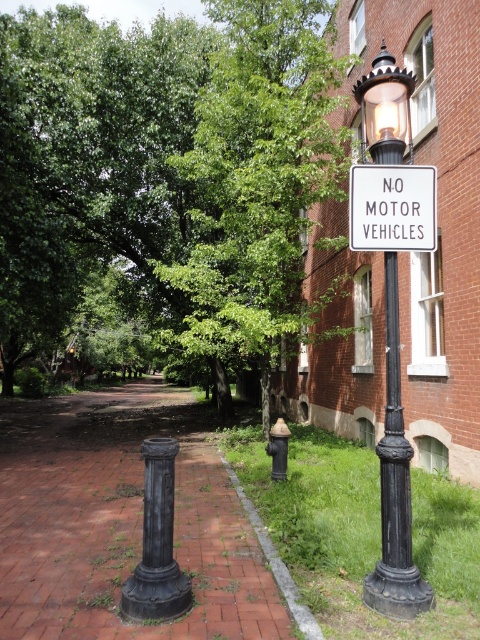
You are a city planner assessing the street layout. You need to install a new streetlight that must be taller than the existing black cast iron post at center. Can the black wrought iron lamp post at center right serve as a suitable replacement?

The black wrought iron lamp post at center right has a greater height compared to the black cast iron post at center, so it can serve as a suitable replacement for the new streetlight that needs to be taller than the existing black cast iron post at center.

You are a city planner assessing the street layout. You need to install a new streetlight between the black wrought iron lamp post at center right and the black cast iron post at center. Which post should the new streetlight be placed closer to, based on their sizes?

The black wrought iron lamp post at center right is larger in size than the black cast iron post at center. Therefore, the new streetlight should be placed closer to the black cast iron post at center to maintain balance in the street layout.

You are a delivery person trying to attach a notice to the white plastic sign at upper center. However, you notice that the black cast iron post at center is in the way. Can you still attach the notice to the sign without moving the post?

The white plastic sign at upper center is smaller than the black cast iron post at center, so the post might block access to the sign, making it difficult to attach the notice without moving the post.